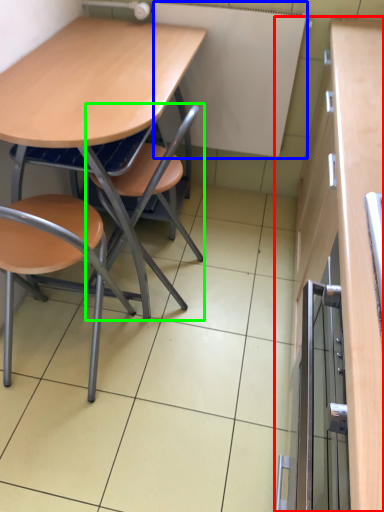
Question: Which object is the closest to the cabinetry (highlighted by a red box)? Choose among these: bulletin board (highlighted by a blue box) or chair (highlighted by a green box).

Choices:
 (A) bulletin board
 (B) chair

Answer: (A)